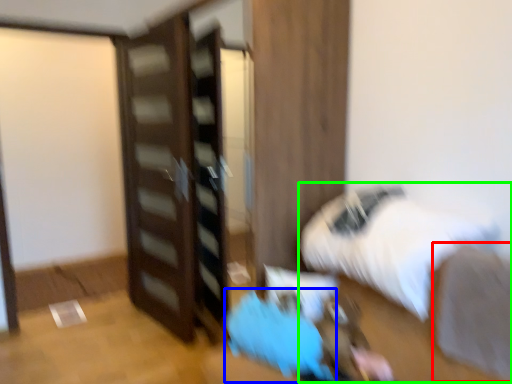
Question: Based on their relative distances, which object is farther from sheet (highlighted by a red box)? Choose from bean bag chair (highlighted by a blue box) and bed (highlighted by a green box).

Choices:
 (A) bean bag chair
 (B) bed

Answer: (A)